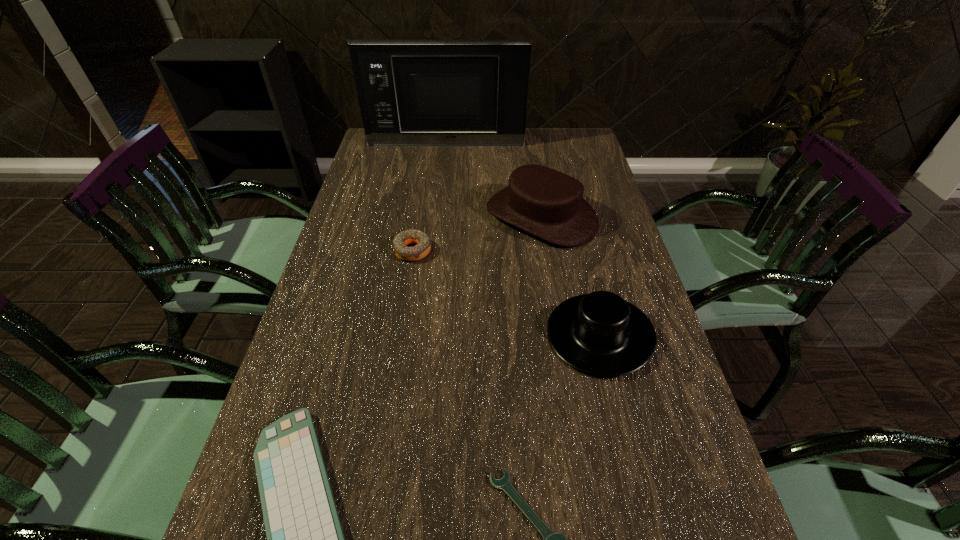
Where is `vacant space located on the back of the doughnut`? This screenshot has width=960, height=540. vacant space located on the back of the doughnut is located at coordinates (423, 184).

At what (x,y) coordinates should I click in order to perform the action: click on object present at the far edge. Please return your answer as a coordinate pair (x, y). Image resolution: width=960 pixels, height=540 pixels. Looking at the image, I should click on (411, 92).

Find the location of a particular element. This screenshot has width=960, height=540. object that is at the left edge is located at coordinates (411, 92).

You are a GUI agent. You are given a task and a screenshot of the screen. Output one action in this format:
    pyautogui.click(x=<x>, y=<y>)
    Task: Click on the object that is at the far left corner
    
    Given the screenshot: What is the action you would take?
    pyautogui.click(x=411, y=92)

At what (x,y) coordinates should I click in order to perform the action: click on vacant space at the far edge of the desktop. Please return your answer as a coordinate pair (x, y). Looking at the image, I should click on point(471,159).

The height and width of the screenshot is (540, 960). I want to click on vacant space at the left edge of the desktop, so click(x=325, y=339).

In the image, there is a desktop. At what (x,y) coordinates should I click in order to perform the action: click on vacant space at the right edge. Please return your answer as a coordinate pair (x, y). The image size is (960, 540). Looking at the image, I should click on (635, 267).

This screenshot has width=960, height=540. What are the coordinates of `vacant space at the far right corner of the desktop` in the screenshot? It's located at (582, 130).

Find the location of a particular element. This screenshot has width=960, height=540. vacant space that's between the farthest object and the shorter dress hat is located at coordinates (523, 239).

Locate an element on the screen. The height and width of the screenshot is (540, 960). empty space between the fourth tallest object and the farthest object is located at coordinates (429, 197).